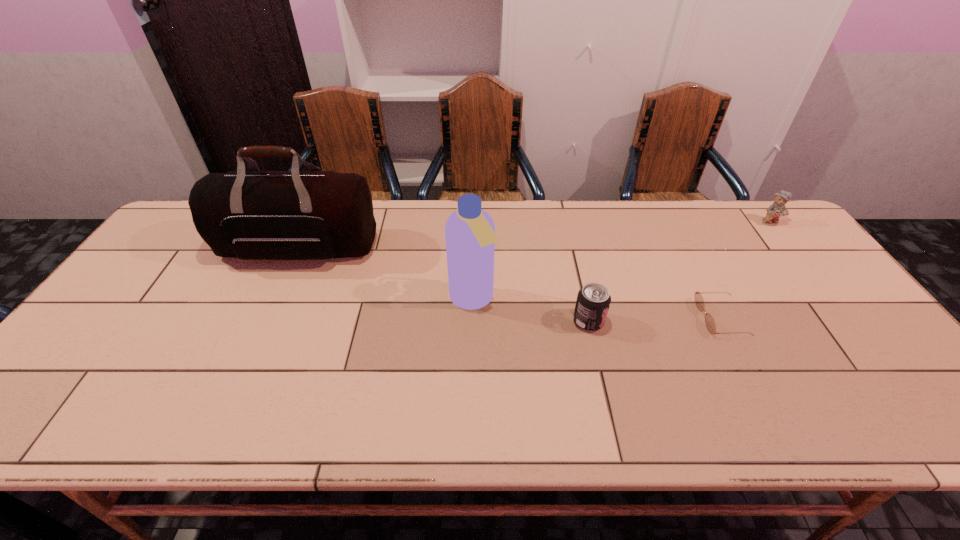
This screenshot has width=960, height=540. In order to click on free space located 0.330m on the face of the shortest object in this screenshot , I will do `click(574, 318)`.

Locate an element on the screen. The width and height of the screenshot is (960, 540). vacant space located on the face of the shortest object is located at coordinates (679, 318).

You are a GUI agent. You are given a task and a screenshot of the screen. Output one action in this format:
    pyautogui.click(x=<x>, y=<y>)
    Task: Click on the vacant space located 0.310m on the face of the shortest object
    Image resolution: width=960 pixels, height=540 pixels.
    Given the screenshot: What is the action you would take?
    pyautogui.click(x=582, y=318)

This screenshot has width=960, height=540. Find the location of `duffel bag that is positioned at the far edge`. duffel bag that is positioned at the far edge is located at coordinates (253, 215).

The image size is (960, 540). In order to click on teddy bear that is at the far edge in this screenshot , I will do `click(777, 209)`.

In order to click on object present at the right edge in this screenshot , I will do `click(777, 209)`.

The image size is (960, 540). What are the coordinates of `object at the far right corner` in the screenshot? It's located at (777, 209).

Locate an element on the screen. This screenshot has width=960, height=540. vacant region at the far edge of the desktop is located at coordinates (673, 232).

In order to click on free space at the near edge of the desktop in this screenshot , I will do `click(240, 402)`.

In the image, there is a desktop. At what (x,y) coordinates should I click in order to perform the action: click on free space at the left edge. Please return your answer as a coordinate pair (x, y). The image size is (960, 540). Looking at the image, I should click on (90, 362).